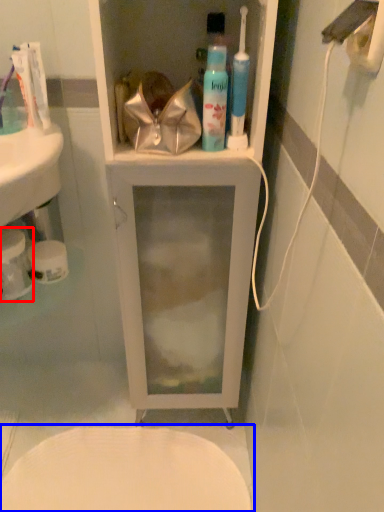
Question: Which of the following is the farthest to the observer, toilet paper (highlighted by a red box) or toilet (highlighted by a blue box)?

Choices:
 (A) toilet paper
 (B) toilet

Answer: (B)